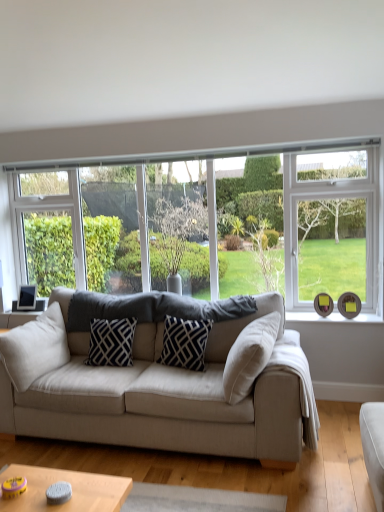
The width and height of the screenshot is (384, 512). What are the coordinates of `empty space that is ontop of navy blue fabric pillow at center, the 3th pillow in the left-to-right sequence (from a real-world perspective)` in the screenshot? It's located at (186, 318).